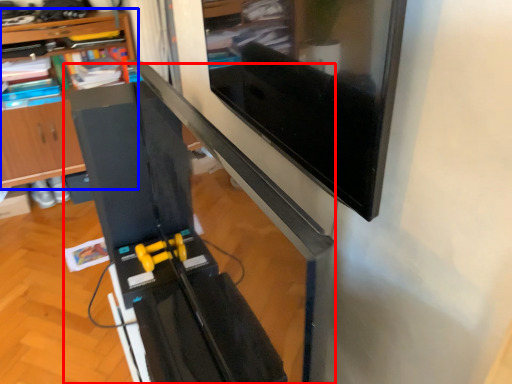
Question: Among these objects, which one is farthest to the camera, computer desk (highlighted by a red box) or shelf (highlighted by a blue box)?

Choices:
 (A) computer desk
 (B) shelf

Answer: (B)